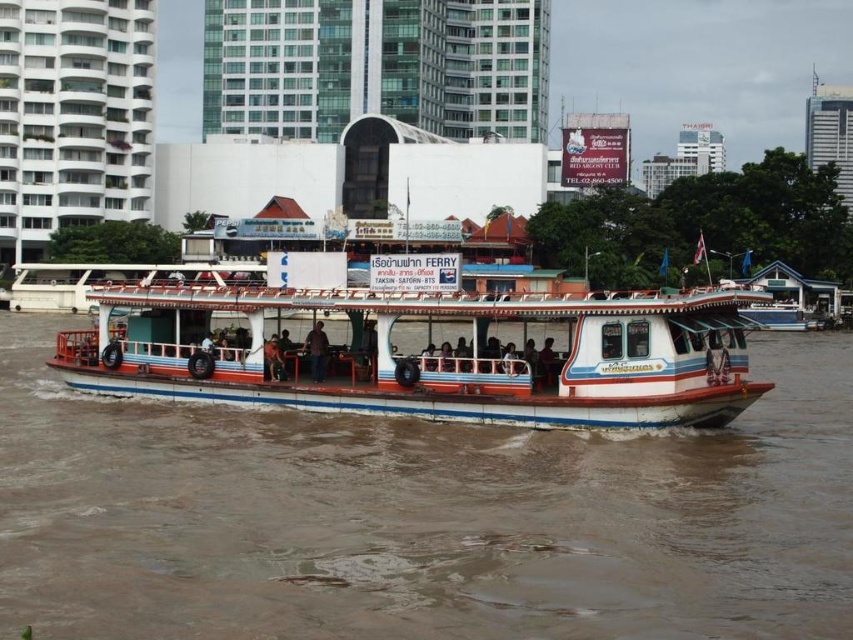
Question: Which object is the farthest from the brown leather jacket at center?

Choices:
 (A) white matte boat at center
 (B) dark brown leather jacket at center

Answer: (A)

Question: Which point is farther from the camera taking this photo?

Choices:
 (A) 274,364
 (B) 368,404
 (C) 756,582

Answer: (A)

Question: Does white matte boat at center have a greater width compared to brown leather jacket at center?

Choices:
 (A) no
 (B) yes

Answer: (B)

Question: Which object is farther from the camera taking this photo?

Choices:
 (A) white matte boat at center
 (B) dark brown leather jacket at center
 (C) brown muddy water at center

Answer: (B)

Question: Does brown leather jacket at center appear on the right side of dark brown leather jacket at center?

Choices:
 (A) yes
 (B) no

Answer: (A)

Question: Is white matte boat at center below dark brown leather jacket at center?

Choices:
 (A) yes
 (B) no

Answer: (B)